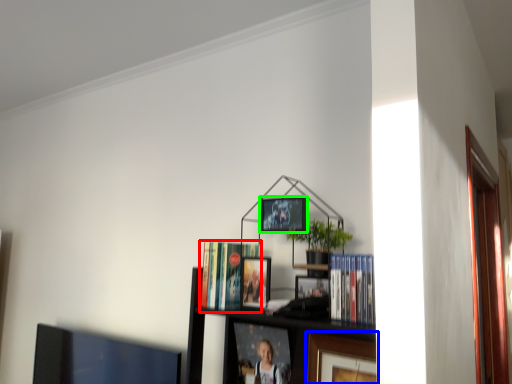
Question: Considering the real-world distances, which object is closest to book (highlighted by a red box)? picture frame (highlighted by a blue box) or picture frame (highlighted by a green box).

Choices:
 (A) picture frame
 (B) picture frame

Answer: (B)